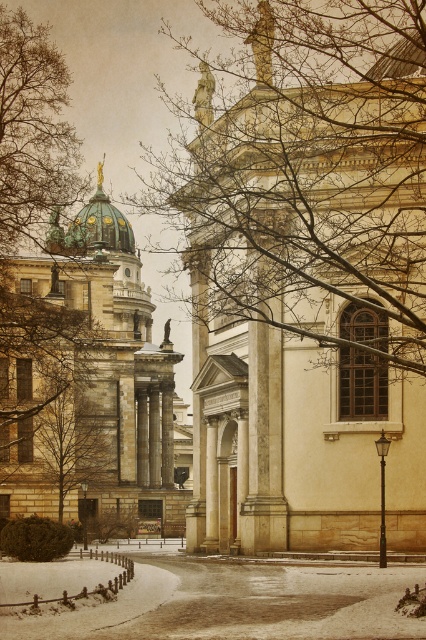
Does bare branches at center appear under brown leafless tree at left?

No.

Can you confirm if bare branches at center is taller than brown leafless tree at left?

Yes.

Which is behind, point (356, 256) or point (20, 109)?

The point (20, 109) is behind.

This screenshot has width=426, height=640. Identify the location of bare branches at center. (310, 172).

Is green marble church at left bigger than brown leafless tree at left?

Yes.

Who is lower down, green marble church at left or brown leafless tree at left?

Positioned lower is green marble church at left.

Identify the location of green marble church at left. The height and width of the screenshot is (640, 426). click(x=86, y=381).

Who is lower down, bare branches at center or green marble church at left?

green marble church at left

The height and width of the screenshot is (640, 426). Find the location of `bare branches at center`. bare branches at center is located at coordinates (310, 172).